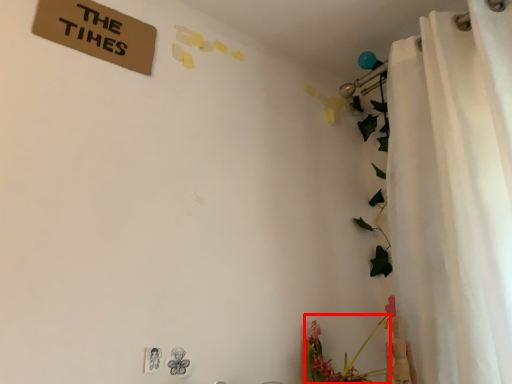
Question: From the image, what is the correct spatial relationship of floral arrangement (annotated by the red box) in relation to curtain?

Choices:
 (A) right
 (B) left

Answer: (B)